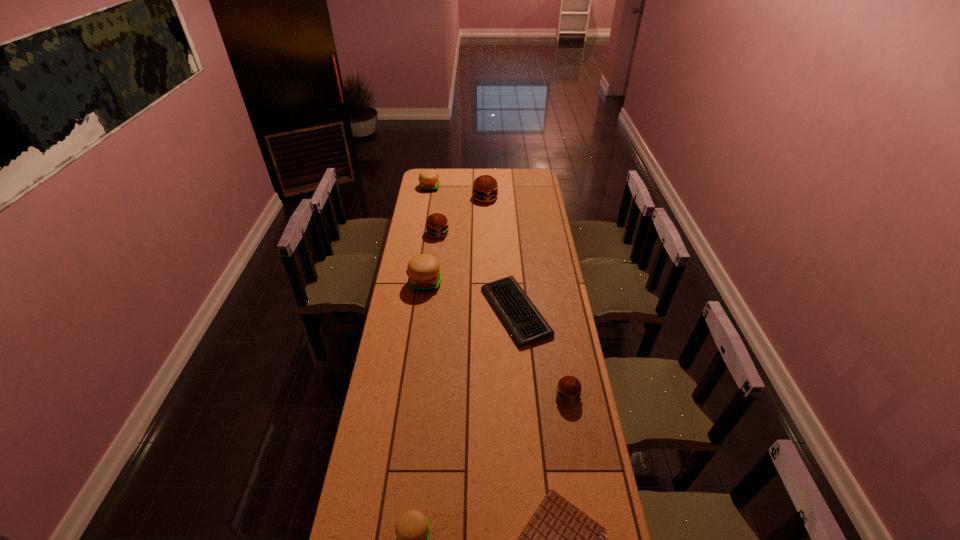
What are the coordinates of `free space located 0.110m on the left of the farthest brown hamburger` in the screenshot? It's located at (454, 198).

Where is `free spot located 0.310m on the back of the biggest beige hamburger`? free spot located 0.310m on the back of the biggest beige hamburger is located at coordinates (432, 235).

Locate an element on the screen. vacant space situated on the back of the third farthest object is located at coordinates (441, 206).

Where is `vacant space located 0.180m on the front of the farthest beige hamburger`? This screenshot has height=540, width=960. vacant space located 0.180m on the front of the farthest beige hamburger is located at coordinates (426, 209).

Identify the location of blank area located 0.170m on the left of the sixth farthest object. (510, 395).

At what (x,y) coordinates should I click in order to perform the action: click on free location located 0.320m on the back of the second shortest object. Please return your answer as a coordinate pair (x, y). This screenshot has width=960, height=540. Looking at the image, I should click on (510, 240).

Where is `object that is at the far edge`? object that is at the far edge is located at coordinates (428, 178).

Image resolution: width=960 pixels, height=540 pixels. I want to click on hamburger that is at the right edge, so click(x=568, y=389).

Where is `computer keyboard situated at the right edge`? This screenshot has width=960, height=540. computer keyboard situated at the right edge is located at coordinates (526, 325).

You are a GUI agent. You are given a task and a screenshot of the screen. Output one action in this format:
    pyautogui.click(x=<x>, y=<y>)
    Task: Click on the object that is at the far left corner
    The width and height of the screenshot is (960, 540).
    Given the screenshot: What is the action you would take?
    pyautogui.click(x=428, y=178)